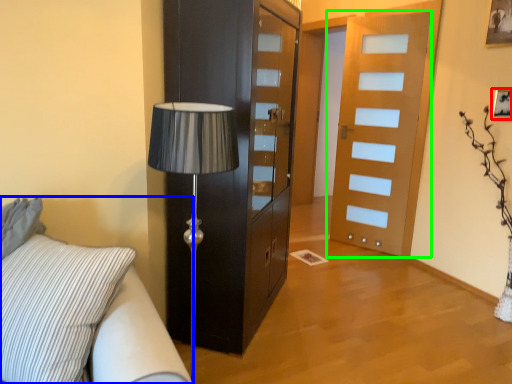
Question: Which object is the closest to the picture frame (highlighted by a red box)? Choose among these: studio couch (highlighted by a blue box) or door (highlighted by a green box).

Choices:
 (A) studio couch
 (B) door

Answer: (B)